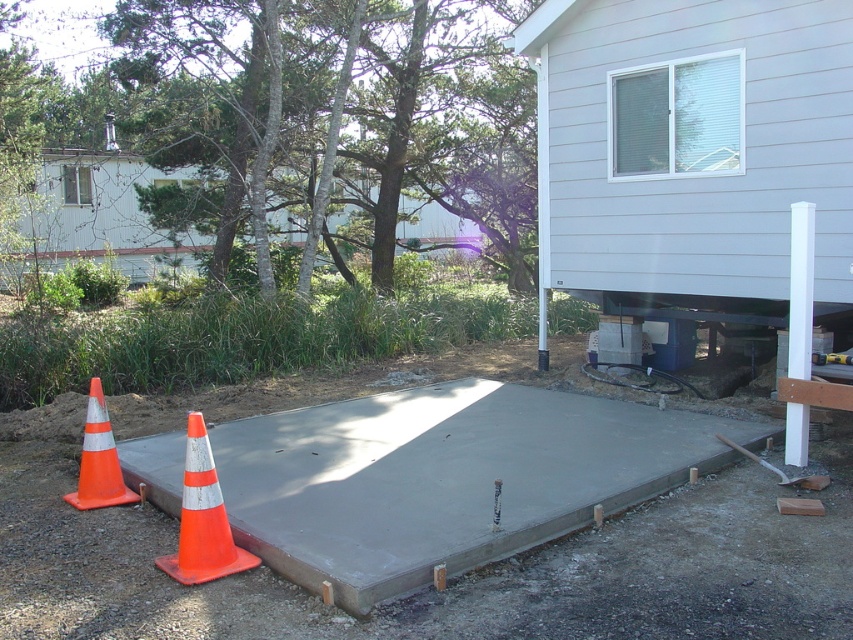
Does orange/cone at lower left lie in front of orange/cone at left?

Yes, orange/cone at lower left is in front of orange/cone at left.

Is orange/cone at lower left thinner than orange/cone at left?

No, orange/cone at lower left is not thinner than orange/cone at left.

Where is `orange/cone at lower left`? orange/cone at lower left is located at coordinates (202, 518).

Does smooth concrete slab at center appear under orange/cone at lower left?

Yes.

Who is higher up, smooth concrete slab at center or orange/cone at lower left?

Positioned higher is orange/cone at lower left.

Is point (573, 440) farther from viewer compared to point (221, 524)?

Yes, it is behind point (221, 524).

This screenshot has height=640, width=853. What are the coordinates of `smooth concrete slab at center` in the screenshot? It's located at (445, 477).

Does smooth concrete slab at center come behind orange/cone at left?

No, it is in front of orange/cone at left.

Identify the location of smooth concrete slab at center. The image size is (853, 640). (445, 477).